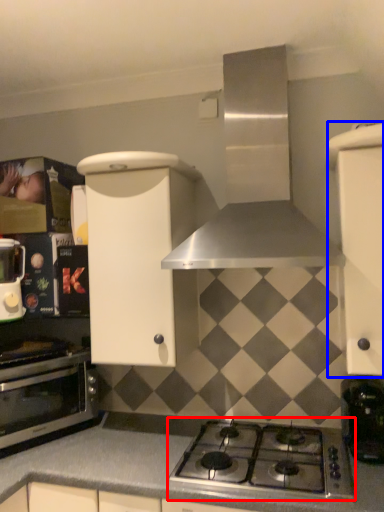
Question: Which object appears farthest to the camera in this image, gas stove (highlighted by a red box) or cabinetry (highlighted by a blue box)?

Choices:
 (A) gas stove
 (B) cabinetry

Answer: (B)